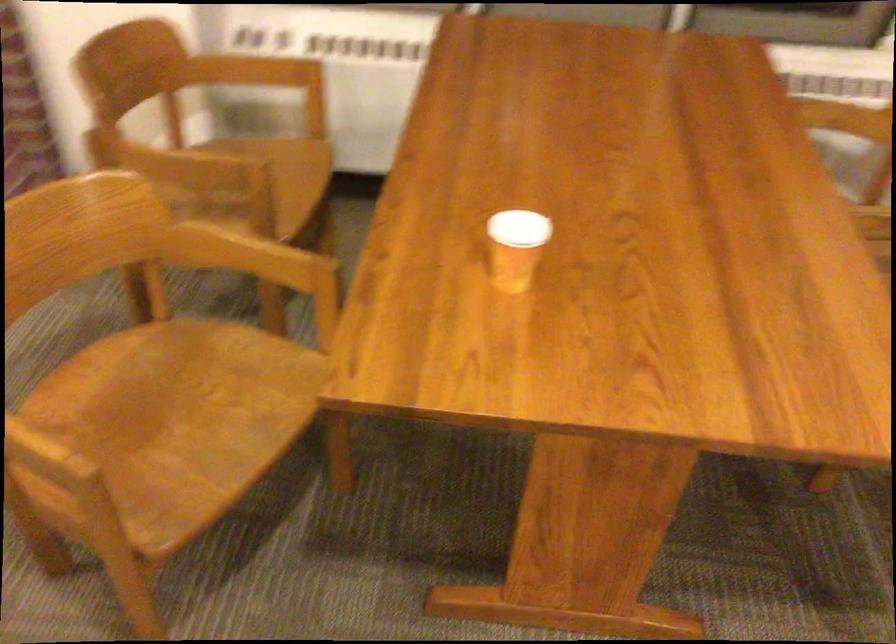
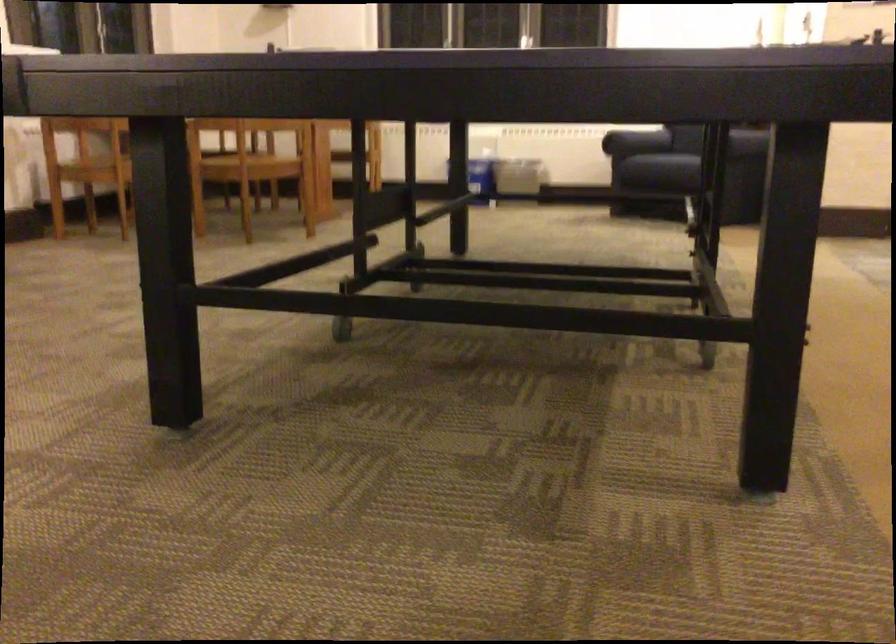
Question: I am providing you with two images of the same scene from different viewpoints. After the viewpoint changes to image2, which objects are now occluded?

Choices:
 (A) black thermos
 (B) sofa armrest
 (C) sofa sitting surface
 (D) chair sitting surface

Answer: (D)